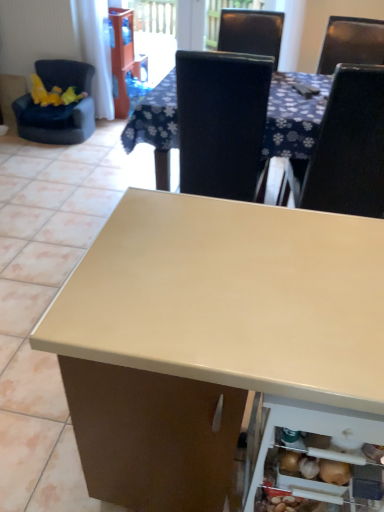
The width and height of the screenshot is (384, 512). What do you see at coordinates (349, 146) in the screenshot? I see `black leather chair at upper right, which appears as the 1th chair when viewed from the front` at bounding box center [349, 146].

How much space does black leather chair at upper right, marked as the 1th chair in a right-to-left arrangement, occupy vertically?

The height of black leather chair at upper right, marked as the 1th chair in a right-to-left arrangement, is 1.05 meters.

You are a GUI agent. You are given a task and a screenshot of the screen. Output one action in this format:
    pyautogui.click(x=<x>, y=<y>)
    Task: Click on the beige laminate table at center
    The width and height of the screenshot is (384, 512).
    Given the screenshot: What is the action you would take?
    pyautogui.click(x=212, y=338)

In order to click on white plastic shelf at lower right in this screenshot , I will do `click(315, 456)`.

Locate an element on the screen. Image resolution: width=384 pixels, height=512 pixels. transparent plastic screen door at upper center is located at coordinates (155, 35).

The image size is (384, 512). I want to click on black leather chair at upper right, marked as the 1th chair in a right-to-left arrangement, so click(x=349, y=146).

From the image's perspective, which is below, white fabric curtain at upper left or black leather chair at upper right, arranged as the 2th chair when viewed from the top?

black leather chair at upper right, arranged as the 2th chair when viewed from the top, is shown below in the image.

Which object is more forward, white fabric curtain at upper left or black leather chair at upper right, positioned as the second chair in left-to-right order?

Positioned in front is black leather chair at upper right, positioned as the second chair in left-to-right order.

Is white fabric curtain at upper left facing towards black leather chair at upper right, the second chair from the back?

No, white fabric curtain at upper left is not facing towards black leather chair at upper right, the second chair from the back.

Is white fabric curtain at upper left to the left or to the right of black leather chair at upper right, which appears as the 1th chair when viewed from the front, in the image?

white fabric curtain at upper left is to the left of black leather chair at upper right, which appears as the 1th chair when viewed from the front.

Would you say beige laminate table at center contains transparent plastic screen door at upper center?

No, transparent plastic screen door at upper center is not a part of beige laminate table at center.

Considering the positions of objects beige laminate table at center and transparent plastic screen door at upper center in the image provided, who is behind, beige laminate table at center or transparent plastic screen door at upper center?

transparent plastic screen door at upper center is behind.

Find the location of a particular element. The height and width of the screenshot is (512, 384). screen door that is on the left side of beige laminate table at center is located at coordinates (155, 35).

Between white fabric curtain at upper left and beige laminate table at center, which one has larger width?

With larger width is beige laminate table at center.

Considering the relative positions of white fabric curtain at upper left and beige laminate table at center in the image provided, is white fabric curtain at upper left to the left of beige laminate table at center from the viewer's perspective?

Yes.

Is transparent plastic screen door at upper center oriented towards beige laminate table at center?

Yes, transparent plastic screen door at upper center is aimed at beige laminate table at center.

From the image's perspective, relative to beige laminate table at center, is transparent plastic screen door at upper center above or below?

transparent plastic screen door at upper center is situated higher than beige laminate table at center in the image.

What's the angular difference between transparent plastic screen door at upper center and beige laminate table at center's facing directions?

The angle between the facing direction of transparent plastic screen door at upper center and the facing direction of beige laminate table at center is 88.4 degrees.

What's the angular difference between black leather chair at upper right, which appears as the 1th chair when viewed from the front, and white fabric curtain at upper left's facing directions?

177 degrees.

How far apart are black leather chair at upper right, the second chair from the back, and white fabric curtain at upper left?

black leather chair at upper right, the second chair from the back, and white fabric curtain at upper left are 2.54 meters apart from each other.

This screenshot has width=384, height=512. I want to click on chair to the right of white fabric curtain at upper left, so click(x=349, y=146).

From the image's perspective, does black leather chair at upper right, the second chair from the back, appear higher than white fabric curtain at upper left?

No.

From a real-world perspective, is white fabric curtain at upper left on top of transparent plastic screen door at upper center?

No, from a real-world perspective, white fabric curtain at upper left is not above transparent plastic screen door at upper center.

Which is behind, point (80, 19) or point (153, 38)?

The point (153, 38) is farther from the camera.

Find the location of a particular element. This screenshot has height=512, width=384. curtain in front of the transparent plastic screen door at upper center is located at coordinates (95, 50).

Is white fabric curtain at upper left next to transparent plastic screen door at upper center and touching it?

white fabric curtain at upper left and transparent plastic screen door at upper center are not in contact.

From a real-world perspective, is white plastic shelf at lower right positioned above or below beige laminate table at center?

white plastic shelf at lower right is situated lower than beige laminate table at center in the real world.

Does white plastic shelf at lower right have a lesser width compared to beige laminate table at center?

Yes.

Is white plastic shelf at lower right aimed at beige laminate table at center?

Yes.

What's the angular difference between white plastic shelf at lower right and beige laminate table at center's facing directions?

89.6 degrees separate the facing orientations of white plastic shelf at lower right and beige laminate table at center.

In the image, there is a black leather chair at upper right, marked as the 1th chair in a right-to-left arrangement. What are the coordinates of `curtain below it (from a real-world perspective)` in the screenshot? It's located at (95, 50).

At what (x,y) coordinates should I click in order to perform the action: click on screen door on the left of the beige laminate table at center. Please return your answer as a coordinate pair (x, y). Image resolution: width=384 pixels, height=512 pixels. Looking at the image, I should click on (155, 35).

Which object lies further to the anchor point velvet-like black armchair at left, the 2th chair positioned from the bottom, transparent plastic screen door at upper center or black leather chair at upper right, marked as the 1th chair in a right-to-left arrangement?

black leather chair at upper right, marked as the 1th chair in a right-to-left arrangement.

Considering their positions, is white fabric curtain at upper left positioned further to velvet-like black armchair at left, marked as the 2th chair in a right-to-left arrangement, than white plastic shelf at lower right?

white plastic shelf at lower right is further to velvet-like black armchair at left, marked as the 2th chair in a right-to-left arrangement.

From the image, which object appears to be farther from white fabric curtain at upper left, velvet-like black armchair at left, which is counted as the 1th chair, starting from the left, or transparent plastic screen door at upper center?

The object further to white fabric curtain at upper left is transparent plastic screen door at upper center.

When comparing their distances from beige laminate table at center, does black leather chair at upper right, arranged as the 2th chair when viewed from the top, or velvet-like black armchair at left, which is counted as the 1th chair, starting from the left, seem further?

Among the two, velvet-like black armchair at left, which is counted as the 1th chair, starting from the left, is located further to beige laminate table at center.

Estimate the real-world distances between objects in this image. Which object is further from beige laminate table at center, black leather chair at upper right, which is counted as the 1th chair, starting from the bottom, or white plastic shelf at lower right?

black leather chair at upper right, which is counted as the 1th chair, starting from the bottom, is further to beige laminate table at center.

Based on their spatial positions, is black leather chair at upper right, positioned as the second chair in left-to-right order, or transparent plastic screen door at upper center closer to beige laminate table at center?

black leather chair at upper right, positioned as the second chair in left-to-right order, is closer to beige laminate table at center.

From the image, which object appears to be farther from beige laminate table at center, velvet-like black armchair at left, which is counted as the 1th chair, starting from the left, or white fabric curtain at upper left?

white fabric curtain at upper left lies further to beige laminate table at center than the other object.

Which object lies further to the anchor point velvet-like black armchair at left, which is the 1th chair from top to bottom, black leather chair at upper right, arranged as the 2th chair when viewed from the top, or white fabric curtain at upper left?

black leather chair at upper right, arranged as the 2th chair when viewed from the top, is further to velvet-like black armchair at left, which is the 1th chair from top to bottom.

Locate an element on the screen. table between black leather chair at upper right, the second chair from the back, and white plastic shelf at lower right from top to bottom is located at coordinates (212, 338).

The image size is (384, 512). I want to click on curtain situated between velvet-like black armchair at left, the 2th chair positioned from the bottom, and black leather chair at upper right, which is counted as the 1th chair, starting from the bottom, from left to right, so click(x=95, y=50).

I want to click on shelf between beige laminate table at center and transparent plastic screen door at upper center in the front-back direction, so click(315, 456).

Identify the location of shelf located between beige laminate table at center and white fabric curtain at upper left in the depth direction. The width and height of the screenshot is (384, 512). (315, 456).